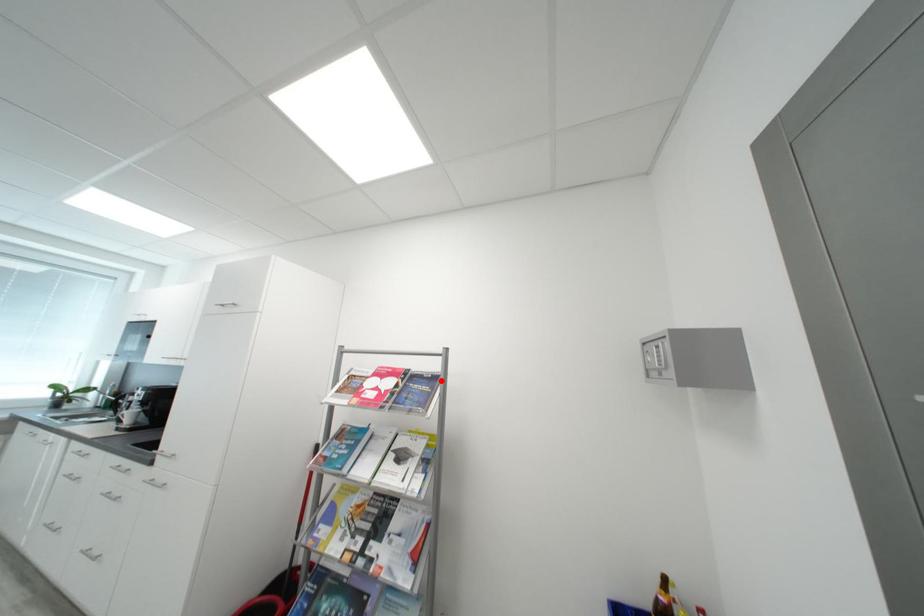
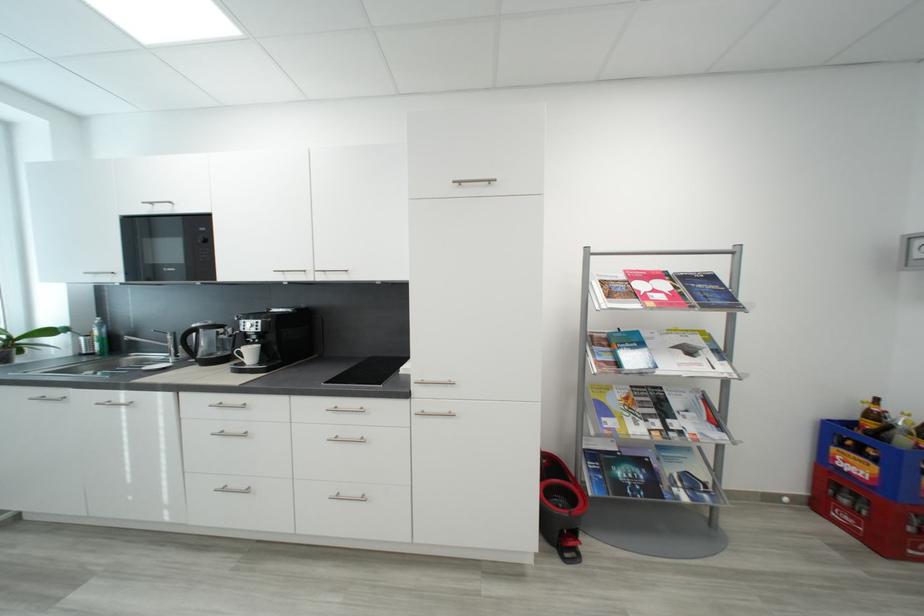
Find the pixel in the second image that matches the highlighted location in the first image.

(718, 280)